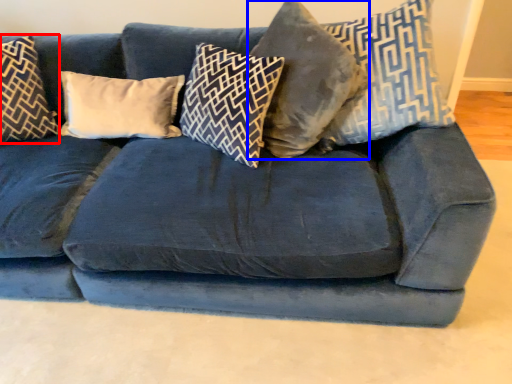
Question: Which point is closer to the camera, pillow (highlighted by a red box) or pillow (highlighted by a blue box)?

Choices:
 (A) pillow
 (B) pillow

Answer: (B)